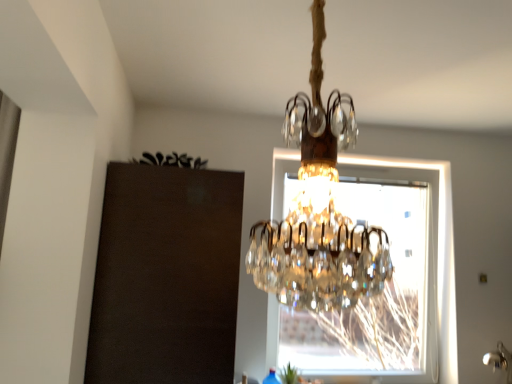
Question: Is transparent glass window at center smaller than green leafy plant at lower center?

Choices:
 (A) yes
 (B) no

Answer: (B)

Question: Considering the relative positions of transparent glass window at center and green leafy plant at lower center in the image provided, is transparent glass window at center to the right of green leafy plant at lower center from the viewer's perspective?

Choices:
 (A) yes
 (B) no

Answer: (A)

Question: Is transparent glass window at center turned away from green leafy plant at lower center?

Choices:
 (A) yes
 (B) no

Answer: (B)

Question: Considering the relative sizes of transparent glass window at center and green leafy plant at lower center in the image provided, is transparent glass window at center thinner than green leafy plant at lower center?

Choices:
 (A) yes
 (B) no

Answer: (B)

Question: From a real-world perspective, is transparent glass window at center located beneath green leafy plant at lower center?

Choices:
 (A) yes
 (B) no

Answer: (B)

Question: From the image's perspective, is transparent glass window at center located beneath green leafy plant at lower center?

Choices:
 (A) yes
 (B) no

Answer: (B)

Question: Is green leafy plant at lower center next to transparent glass window at center and touching it?

Choices:
 (A) no
 (B) yes

Answer: (A)

Question: From a real-world perspective, is green leafy plant at lower center positioned under transparent glass window at center based on gravity?

Choices:
 (A) no
 (B) yes

Answer: (B)

Question: Could you tell me if green leafy plant at lower center is facing transparent glass window at center?

Choices:
 (A) no
 (B) yes

Answer: (A)

Question: From a real-world perspective, does green leafy plant at lower center stand above transparent glass window at center?

Choices:
 (A) no
 (B) yes

Answer: (A)

Question: Is green leafy plant at lower center bigger than transparent glass window at center?

Choices:
 (A) yes
 (B) no

Answer: (B)

Question: Would you consider green leafy plant at lower center to be distant from transparent glass window at center?

Choices:
 (A) no
 (B) yes

Answer: (B)

Question: In terms of width, does green leafy plant at lower center look wider or thinner when compared to transparent glass window at center?

Choices:
 (A) thin
 (B) wide

Answer: (A)